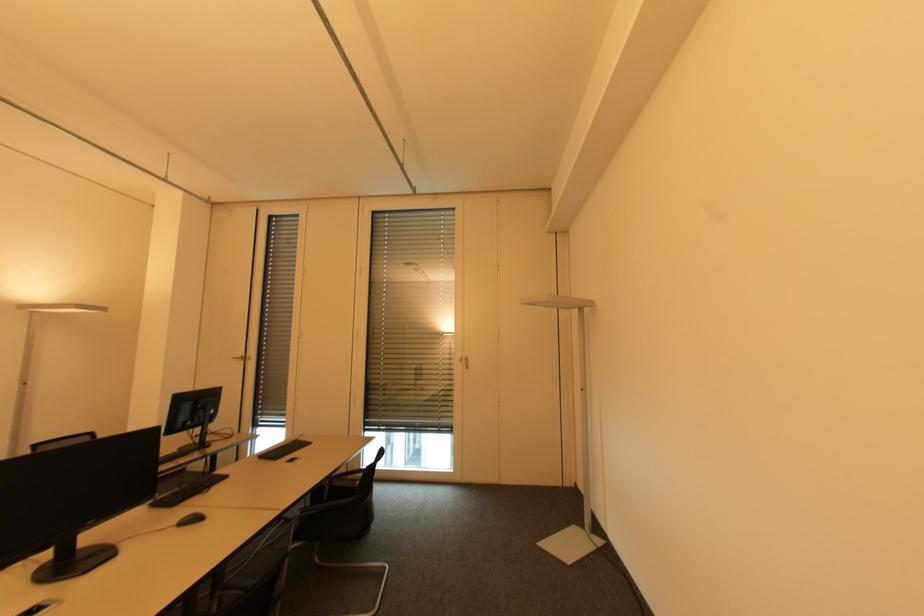
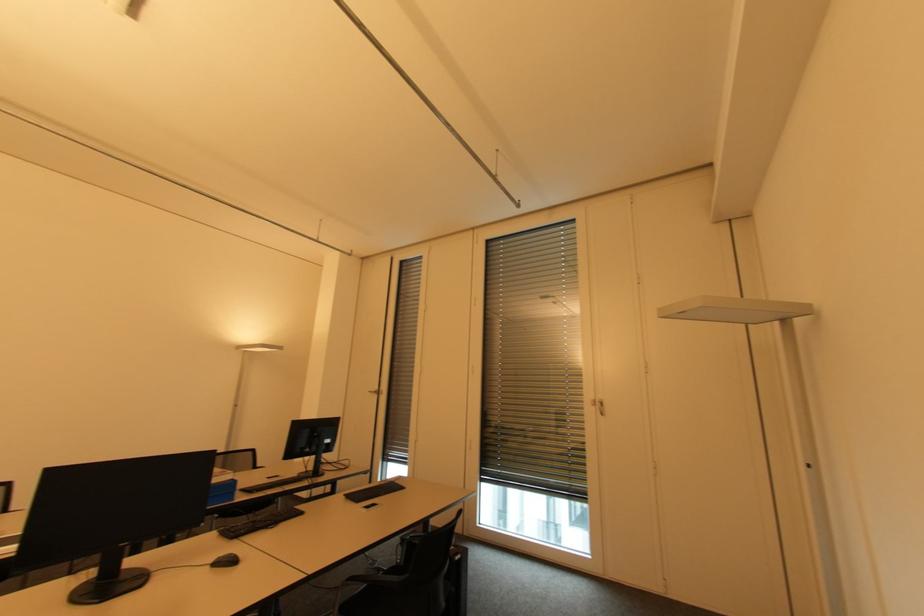
In the second image, find the point that corresponds to (x=222, y=476) in the first image.

(300, 511)